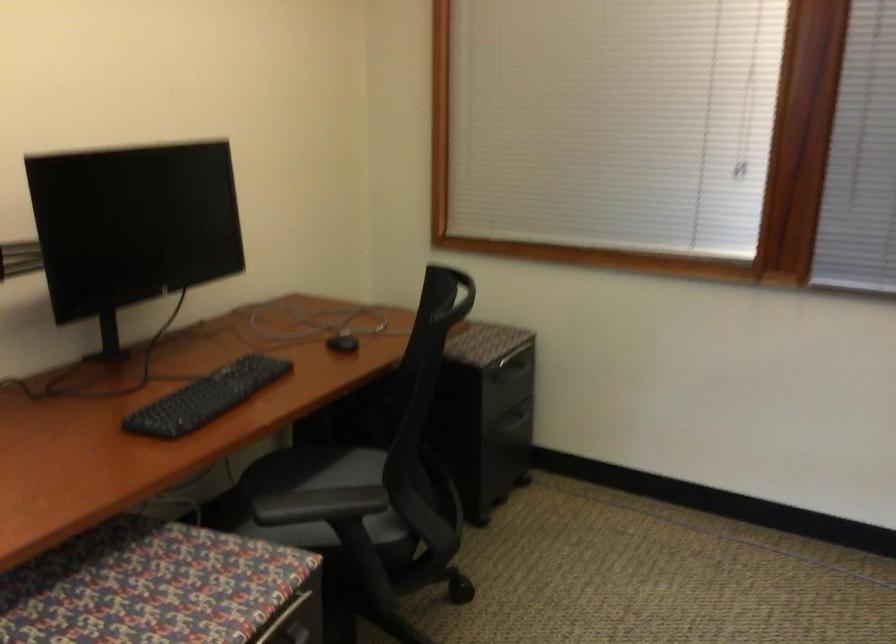
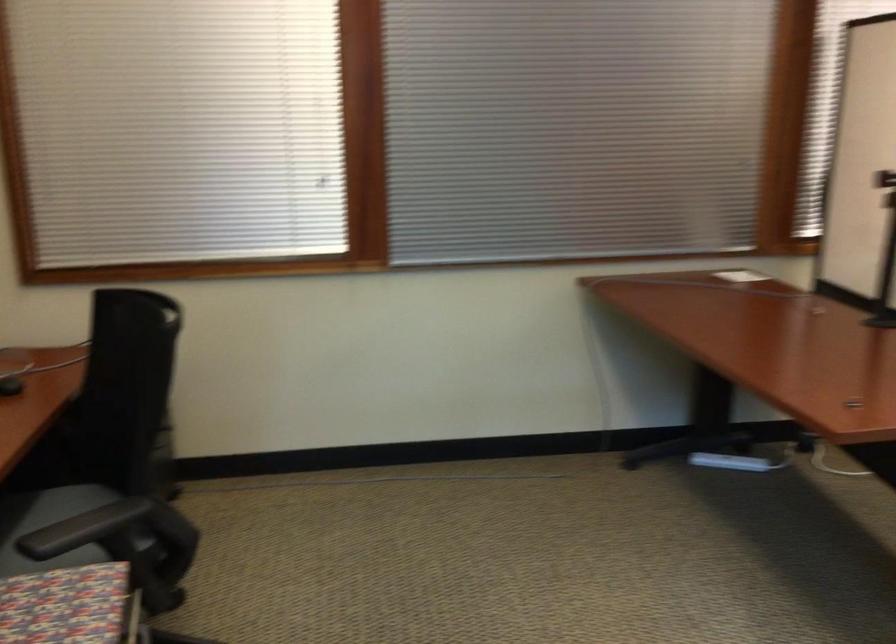
Find the pixel in the second image that matches pixel 299 503 in the first image.

(83, 529)